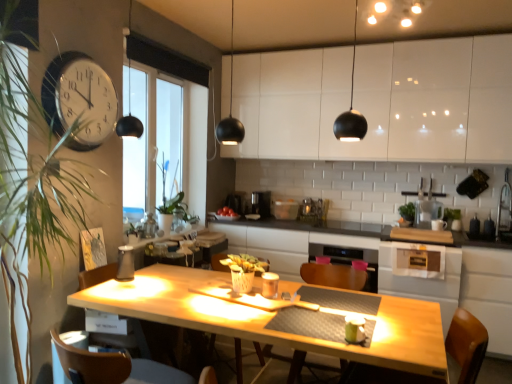
In order to face black plastic coffee machine at center, which is the 1th coffee machine in right-to-left order, should I rotate leftwards or rightwards?

Turn right approximately 0.719 degrees to face it.

The width and height of the screenshot is (512, 384). Describe the element at coordinates (114, 367) in the screenshot. I see `brown wood chair at lower left, marked as the 2th chair in a right-to-left arrangement` at that location.

Describe the element at coordinates (170, 197) in the screenshot. I see `green leafy plant at center, placed as the 2th plant when sorted from front to back` at that location.

This screenshot has width=512, height=384. What do you see at coordinates (79, 99) in the screenshot? I see `white glossy clock at upper left` at bounding box center [79, 99].

Find the location of `wooden at center`. wooden at center is located at coordinates (391, 269).

Does wooden chair at lower right, which is counted as the 2th chair, starting from the left, have a smaller size compared to green leafy plant at left, arranged as the second plant when viewed from the back?

Yes.

Considering the sizes of objects wooden chair at lower right, placed as the first chair when sorted from right to left, and green leafy plant at left, the first plant in the front-to-back sequence, in the image provided, who is shorter, wooden chair at lower right, placed as the first chair when sorted from right to left, or green leafy plant at left, the first plant in the front-to-back sequence,?

Standing shorter between the two is wooden chair at lower right, placed as the first chair when sorted from right to left.

Are wooden chair at lower right, which is counted as the 2th chair, starting from the left, and green leafy plant at left, the first plant in the front-to-back sequence, far apart?

Yes, wooden chair at lower right, which is counted as the 2th chair, starting from the left, and green leafy plant at left, the first plant in the front-to-back sequence, are located far from each other.

Is wooden chair at lower right, placed as the first chair when sorted from right to left, oriented away from green leafy plant at left, the first plant in the front-to-back sequence?

No, green leafy plant at left, the first plant in the front-to-back sequence, is not at the back of wooden chair at lower right, placed as the first chair when sorted from right to left.

Choose the correct answer: Is wooden chair at center inside transparent plastic pitcher at upper right, which is the 1th appliance in back-to-front order, or outside it?

The correct answer is: outside.

Is wooden chair at center far from transparent plastic pitcher at upper right, the second appliance ordered from the bottom?

Yes, wooden chair at center is far from transparent plastic pitcher at upper right, the second appliance ordered from the bottom.

The width and height of the screenshot is (512, 384). Identify the location of armchair that is under the transparent plastic pitcher at upper right, the second appliance ordered from the bottom (from a real-world perspective). (333, 276).

Does wooden chair at center turn towards transparent plastic pitcher at upper right, which appears as the second appliance when viewed from the front?

No, wooden chair at center is not turned towards transparent plastic pitcher at upper right, which appears as the second appliance when viewed from the front.

Is warm matte ceiling lights at upper center bigger or smaller than wooden at center?

warm matte ceiling lights at upper center is smaller than wooden at center.

In the scene shown: Would you say warm matte ceiling lights at upper center is outside wooden at center?

Indeed, warm matte ceiling lights at upper center is completely outside wooden at center.

Does warm matte ceiling lights at upper center touch wooden at center?

No.

Where is `lighting on the left of wooden at center`? Image resolution: width=512 pixels, height=384 pixels. lighting on the left of wooden at center is located at coordinates (393, 11).

From a real-world perspective, between green leafy plant at center, positioned as the first plant in back-to-front order, and white glossy clock at upper left, who is vertically lower?

green leafy plant at center, positioned as the first plant in back-to-front order, from a real-world perspective.

Is green leafy plant at center, placed as the 2th plant when sorted from front to back, touching white glossy clock at upper left?

green leafy plant at center, placed as the 2th plant when sorted from front to back, is not next to white glossy clock at upper left, and they're not touching.

From the picture: Which object is thinner, green leafy plant at center, positioned as the first plant in back-to-front order, or white glossy clock at upper left?

white glossy clock at upper left.

From the image's perspective, starting from the white glossy clock at upper left, which plant is the 1st one below? Please provide its 2D coordinates.

[(170, 197)]

Could you measure the distance between warm matte ceiling lights at upper center and white glossy cabinets at upper center?

warm matte ceiling lights at upper center is 32.85 inches away from white glossy cabinets at upper center.

Can you confirm if warm matte ceiling lights at upper center is positioned to the right of white glossy cabinets at upper center?

No.

Could you tell me if warm matte ceiling lights at upper center is turned towards white glossy cabinets at upper center?

No, warm matte ceiling lights at upper center is not turned towards white glossy cabinets at upper center.

Consider the image. From the image's perspective, between warm matte ceiling lights at upper center and white glossy cabinets at upper center, who is located below?

white glossy cabinets at upper center, from the image's perspective.

Between white glossy cabinets at upper center and transparent plastic pitcher at upper right, which is the 1th appliance in back-to-front order, which one appears on the right side from the viewer's perspective?

transparent plastic pitcher at upper right, which is the 1th appliance in back-to-front order, is more to the right.

Considering the relative sizes of white glossy cabinets at upper center and transparent plastic pitcher at upper right, which is the 1th appliance in back-to-front order, in the image provided, is white glossy cabinets at upper center bigger than transparent plastic pitcher at upper right, which is the 1th appliance in back-to-front order,?

Yes.

Considering the sizes of white glossy cabinets at upper center and transparent plastic pitcher at upper right, the second appliance ordered from the bottom, in the image, is white glossy cabinets at upper center taller or shorter than transparent plastic pitcher at upper right, the second appliance ordered from the bottom,?

white glossy cabinets at upper center is taller than transparent plastic pitcher at upper right, the second appliance ordered from the bottom.

Does white glossy cabinets at upper center have a lesser width compared to transparent plastic pitcher at upper right, the 1th appliance viewed from the top?

Incorrect, the width of white glossy cabinets at upper center is not less than that of transparent plastic pitcher at upper right, the 1th appliance viewed from the top.

Can you confirm if green leafy plant at center, placed as the 2th plant when sorted from front to back, is shorter than transparent plastic pitcher at upper right, which is the 1th appliance in back-to-front order?

Incorrect, the height of green leafy plant at center, placed as the 2th plant when sorted from front to back, does not fall short of that of transparent plastic pitcher at upper right, which is the 1th appliance in back-to-front order.

Is green leafy plant at center, placed as the 2th plant when sorted from front to back, completely or partially outside of transparent plastic pitcher at upper right, the second appliance ordered from the bottom?

Absolutely, green leafy plant at center, placed as the 2th plant when sorted from front to back, is external to transparent plastic pitcher at upper right, the second appliance ordered from the bottom.

In the scene shown: Is green leafy plant at center, placed as the 2th plant when sorted from front to back, further to the viewer compared to transparent plastic pitcher at upper right, the 2th appliance viewed from the left?

No, it is in front of transparent plastic pitcher at upper right, the 2th appliance viewed from the left.

Does green leafy plant at center, placed as the 2th plant when sorted from front to back, turn towards transparent plastic pitcher at upper right, the 1th appliance viewed from the top?

No, green leafy plant at center, placed as the 2th plant when sorted from front to back, does not turn towards transparent plastic pitcher at upper right, the 1th appliance viewed from the top.

Where is `plant lying in front of the wooden chair at lower right, placed as the first chair when sorted from right to left`? The width and height of the screenshot is (512, 384). plant lying in front of the wooden chair at lower right, placed as the first chair when sorted from right to left is located at coordinates (31, 188).

Identify the location of armchair below the transparent plastic pitcher at upper right, the second appliance ordered from the bottom (from a real-world perspective). The width and height of the screenshot is (512, 384). point(333,276).

Estimate the real-world distances between objects in this image. Which object is further from transparent plastic pitcher at upper right, the 2th appliance viewed from the left, white glossy clock at upper left or white glossy cabinets at upper center?

Based on the image, white glossy clock at upper left appears to be further to transparent plastic pitcher at upper right, the 2th appliance viewed from the left.

Looking at the image, which one is located closer to white glossy clock at upper left, black plastic coffee machine at center, the second coffee machine positioned from the right, or matte silver kettle at lower left, arranged as the 2th appliance when viewed from the top?

Among the two, matte silver kettle at lower left, arranged as the 2th appliance when viewed from the top, is located nearer to white glossy clock at upper left.

When comparing their distances from matte silver kettle at lower left, which is the 1th appliance in front-to-back order, does wooden at center or wooden chair at lower right, placed as the first chair when sorted from right to left, seem closer?

Based on the image, wooden at center appears to be nearer to matte silver kettle at lower left, which is the 1th appliance in front-to-back order.

Which object lies nearer to the anchor point matte silver kettle at lower left, which appears as the 1th appliance when viewed from the left, green leafy plant at center, placed as the 2th plant when sorted from front to back, or wooden chair at lower right, placed as the first chair when sorted from right to left?

The object closer to matte silver kettle at lower left, which appears as the 1th appliance when viewed from the left, is green leafy plant at center, placed as the 2th plant when sorted from front to back.

Based on their spatial positions, is wooden chair at lower right, which is counted as the 2th chair, starting from the left, or brown wood chair at lower left, marked as the 2th chair in a right-to-left arrangement, closer to green leafy plant at center, positioned as the first plant in back-to-front order?

brown wood chair at lower left, marked as the 2th chair in a right-to-left arrangement, is closer to green leafy plant at center, positioned as the first plant in back-to-front order.

Based on the photo, looking at the image, which one is located closer to wooden chair at lower right, which is counted as the 2th chair, starting from the left, brown wood chair at lower left, marked as the 2th chair in a right-to-left arrangement, or green leafy plant at center, positioned as the first plant in back-to-front order?

Among the two, brown wood chair at lower left, marked as the 2th chair in a right-to-left arrangement, is located nearer to wooden chair at lower right, which is counted as the 2th chair, starting from the left.

Looking at the image, which one is located further to matte silver kettle at lower left, marked as the 1th appliance in a bottom-to-top arrangement, warm matte ceiling lights at upper center or black plastic coffee machine at center, which is the 1th coffee machine in right-to-left order?

warm matte ceiling lights at upper center lies further to matte silver kettle at lower left, marked as the 1th appliance in a bottom-to-top arrangement, than the other object.

Which object lies nearer to the anchor point green leafy plant at left, arranged as the second plant when viewed from the back, wooden at center or white glossy clock at upper left?

white glossy clock at upper left lies closer to green leafy plant at left, arranged as the second plant when viewed from the back, than the other object.

This screenshot has width=512, height=384. I want to click on clock between brown wood chair at lower left, marked as the 2th chair in a right-to-left arrangement, and black plastic coffee machine at center, the second coffee machine viewed from the left, along the z-axis, so click(79, 99).

In order to click on coffee machine between white glossy clock at upper left and black plastic coffee machine at center, the second coffee machine positioned from the right, along the z-axis in this screenshot , I will do `click(261, 203)`.

You are a GUI agent. You are given a task and a screenshot of the screen. Output one action in this format:
    pyautogui.click(x=<x>, y=<y>)
    Task: Click on the window screen between green leafy plant at left, arranged as the second plant when viewed from the back, and green leafy plant at center, positioned as the first plant in back-to-front order, along the z-axis
    
    Given the screenshot: What is the action you would take?
    tap(152, 139)

Find the location of `lighting located between green leafy plant at left, the first plant in the front-to-back sequence, and white glossy cabinets at upper center in the left-right direction`. lighting located between green leafy plant at left, the first plant in the front-to-back sequence, and white glossy cabinets at upper center in the left-right direction is located at coordinates (393, 11).